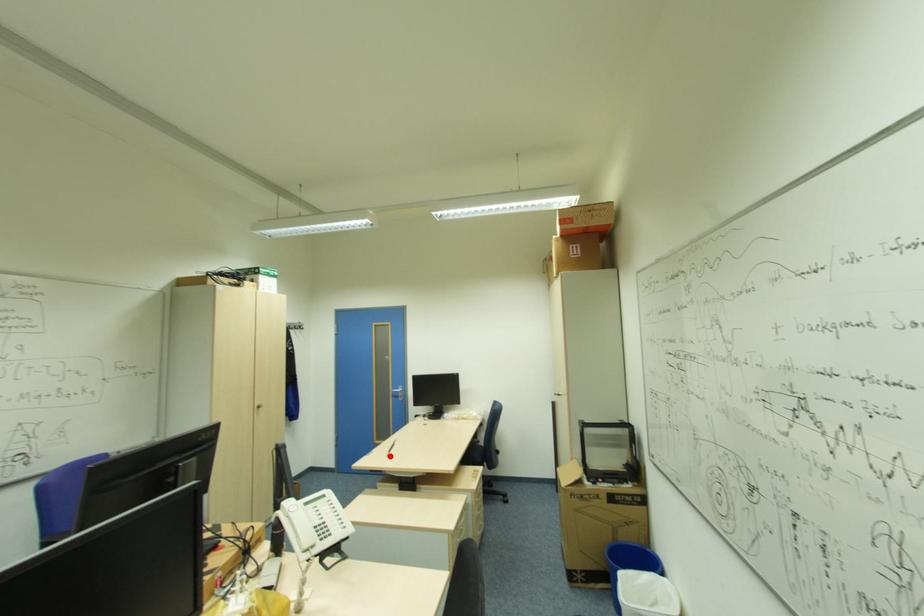
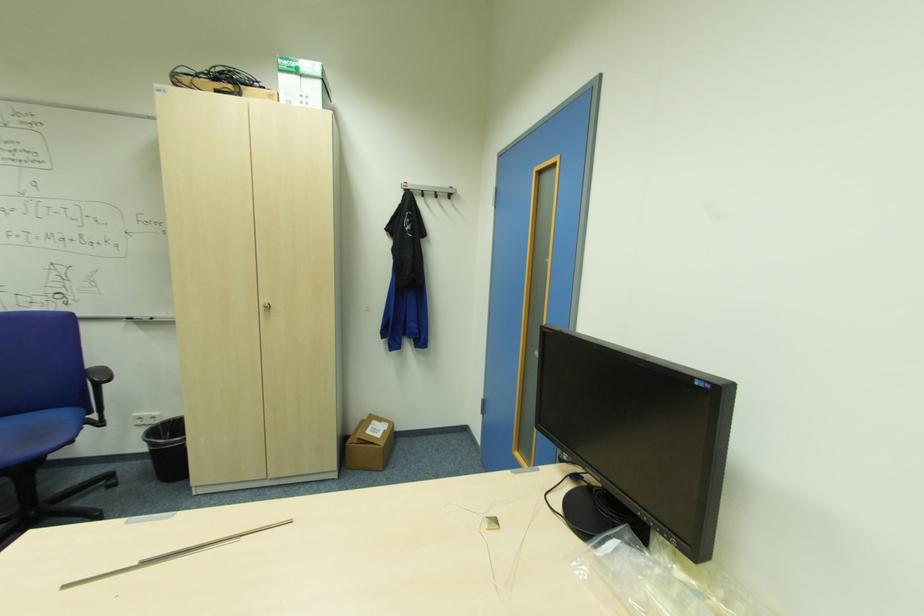
Where in the second image is the point corresponding to the highlighted location from the first image?

(63, 589)